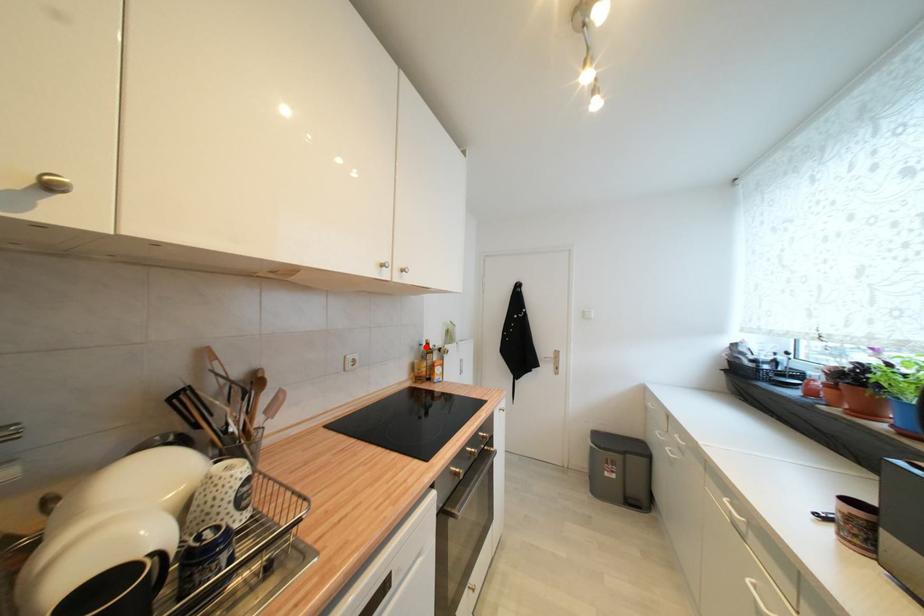
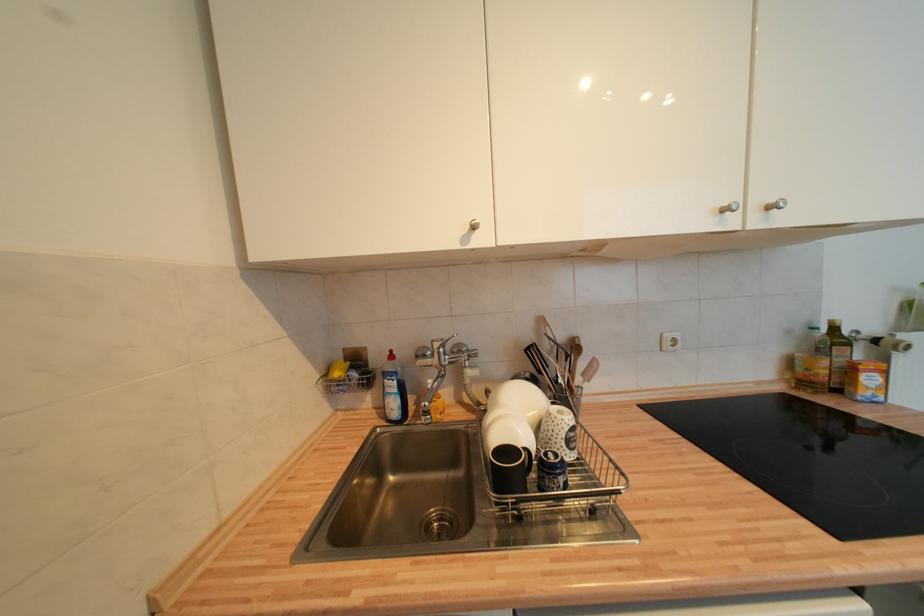
The point at the highlighted location is marked in the first image. Where is the corresponding point in the second image?

(819, 331)